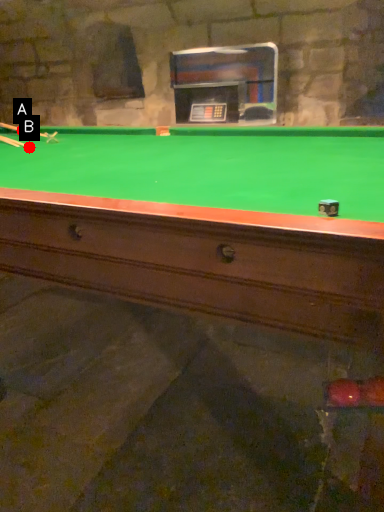
Question: Two points are circled on the image, labeled by A and B beside each circle. Which point is closer to the camera?

Choices:
 (A) A is closer
 (B) B is closer

Answer: (B)